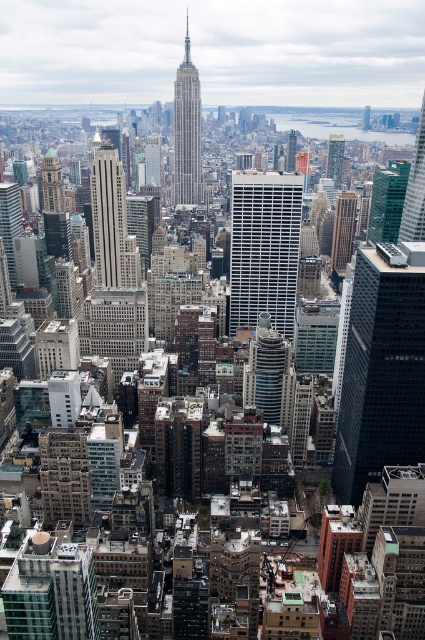
Question: Does matte gray skyscraper at center come behind silver metallic skyscraper at center?

Choices:
 (A) yes
 (B) no

Answer: (B)

Question: Among these points, which one is nearest to the camera?

Choices:
 (A) click(x=252, y=388)
 (B) click(x=385, y=236)
 (C) click(x=59, y=204)

Answer: (A)

Question: Does dark glass skyscraper at center-right appear under silver metallic skyscraper at center?

Choices:
 (A) no
 (B) yes

Answer: (B)

Question: Is brown brick building at center further to camera compared to gold textured clock tower at left?

Choices:
 (A) yes
 (B) no

Answer: (B)

Question: Based on their relative distances, which object is farther from the matte gray skyscraper at center?

Choices:
 (A) silver metallic skyscraper at center
 (B) dark glass skyscraper at center-right

Answer: (B)

Question: Which of the following is the closest to the observer?

Choices:
 (A) matte gray skyscraper at center
 (B) gold textured clock tower at left

Answer: (A)